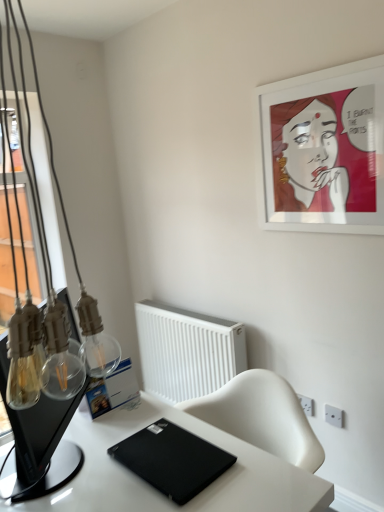
Question: Does black matte laptop at lower center have a smaller size compared to white plastic radiator at center?

Choices:
 (A) no
 (B) yes

Answer: (B)

Question: Is the depth of black matte laptop at lower center less than that of white plastic radiator at center?

Choices:
 (A) no
 (B) yes

Answer: (B)

Question: Does black matte laptop at lower center appear on the right side of white plastic radiator at center?

Choices:
 (A) yes
 (B) no

Answer: (B)

Question: Does black matte laptop at lower center turn towards white plastic radiator at center?

Choices:
 (A) yes
 (B) no

Answer: (B)

Question: From the image's perspective, would you say black matte laptop at lower center is positioned over white plastic radiator at center?

Choices:
 (A) yes
 (B) no

Answer: (B)

Question: Are black matte laptop at lower center and white plastic radiator at center far apart?

Choices:
 (A) yes
 (B) no

Answer: (A)

Question: Is black matte laptop at lower center further to camera compared to white glossy desk at center?

Choices:
 (A) no
 (B) yes

Answer: (B)

Question: Is black matte laptop at lower center oriented away from white glossy desk at center?

Choices:
 (A) no
 (B) yes

Answer: (B)

Question: Is black matte laptop at lower center bigger than white glossy desk at center?

Choices:
 (A) yes
 (B) no

Answer: (B)

Question: Are black matte laptop at lower center and white glossy desk at center beside each other?

Choices:
 (A) yes
 (B) no

Answer: (A)

Question: From the image's perspective, does black matte laptop at lower center appear lower than white glossy desk at center?

Choices:
 (A) yes
 (B) no

Answer: (B)

Question: From a real-world perspective, does black matte laptop at lower center sit lower than white glossy desk at center?

Choices:
 (A) no
 (B) yes

Answer: (A)

Question: Are white matte picture frame at upper right and white glossy desk at center beside each other?

Choices:
 (A) yes
 (B) no

Answer: (B)